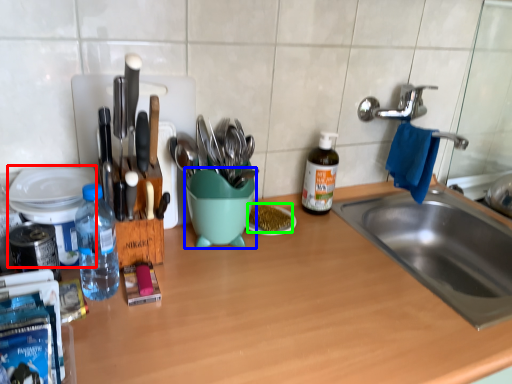
Question: Which is nearer to the appliance (highlighted by a red box)? mixing bowl (highlighted by a blue box) or food (highlighted by a green box).

Choices:
 (A) mixing bowl
 (B) food

Answer: (A)